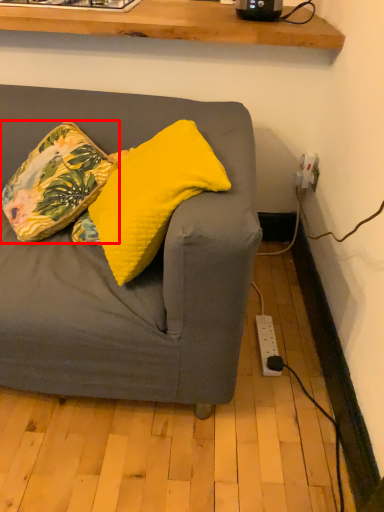
Question: From the image's perspective, what is the correct spatial relationship of pillow (annotated by the red box) in relation to pillow?

Choices:
 (A) below
 (B) above

Answer: (B)